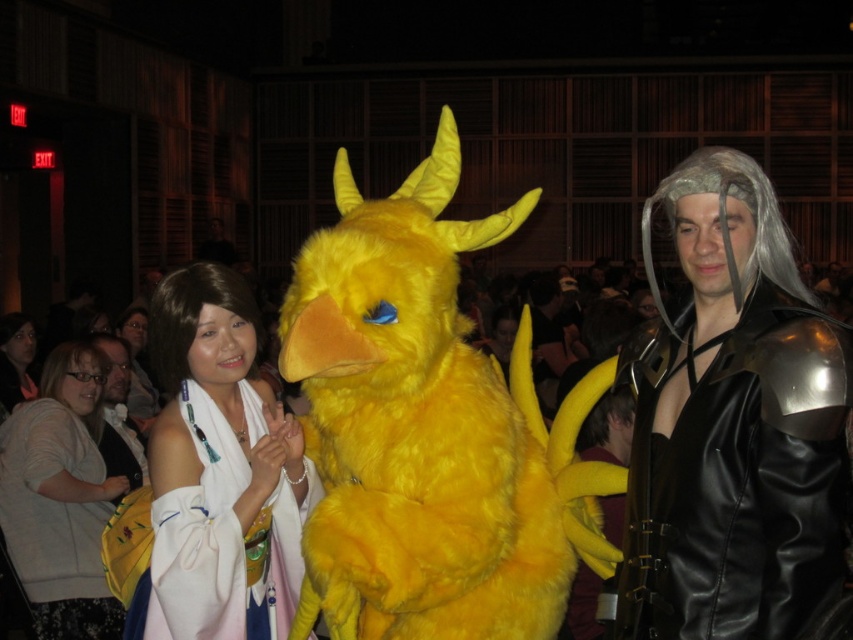
You are a photographer at the event and need to decide which of the two center costumes, the white satin kimono at center or the white fabric dress at center, will fit better in a standard photo frame that can only accommodate smaller items. Which one should you choose?

The white satin kimono at center is smaller than the white fabric dress at center, so the white satin kimono at center will fit better in the standard photo frame designed for smaller items.

You are a photographer at the event and need to capture both the shiny silver armor at right and the white satin kimono at center in a single frame. Given their height difference, which object should you position closer to the camera to ensure both are fully visible?

The shiny silver armor at right is taller than the white satin kimono at center. To ensure both are fully visible in the frame, position the shiny silver armor at right closer to the camera so its height is reduced in perspective, while keeping the white satin kimono at center further back to maintain its visibility.